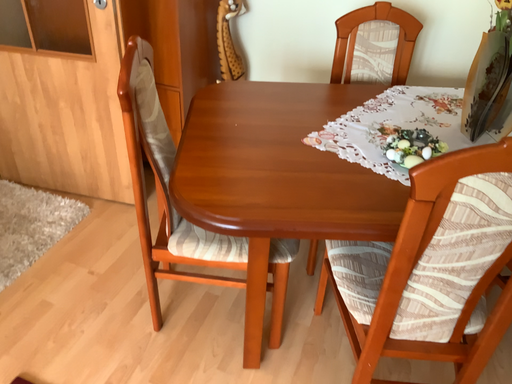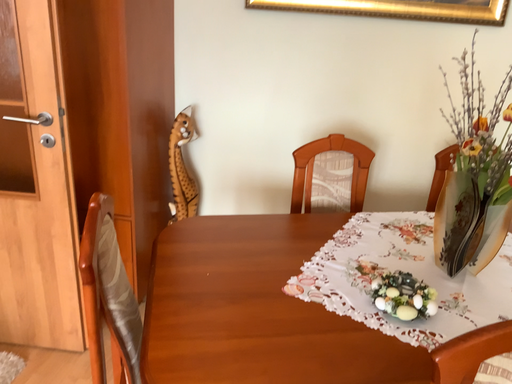
Question: How did the camera likely rotate when shooting the video?

Choices:
 (A) rotated left
 (B) rotated right

Answer: (B)